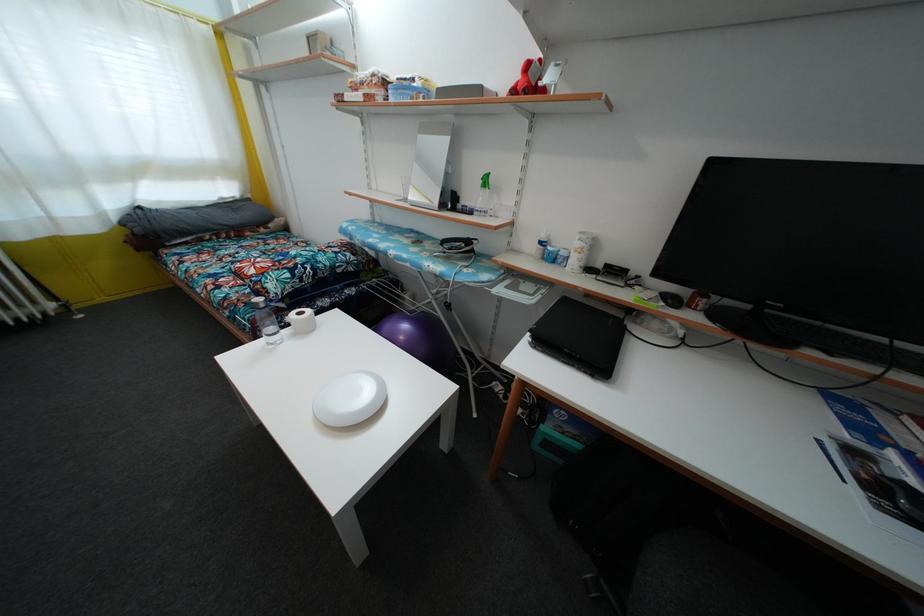
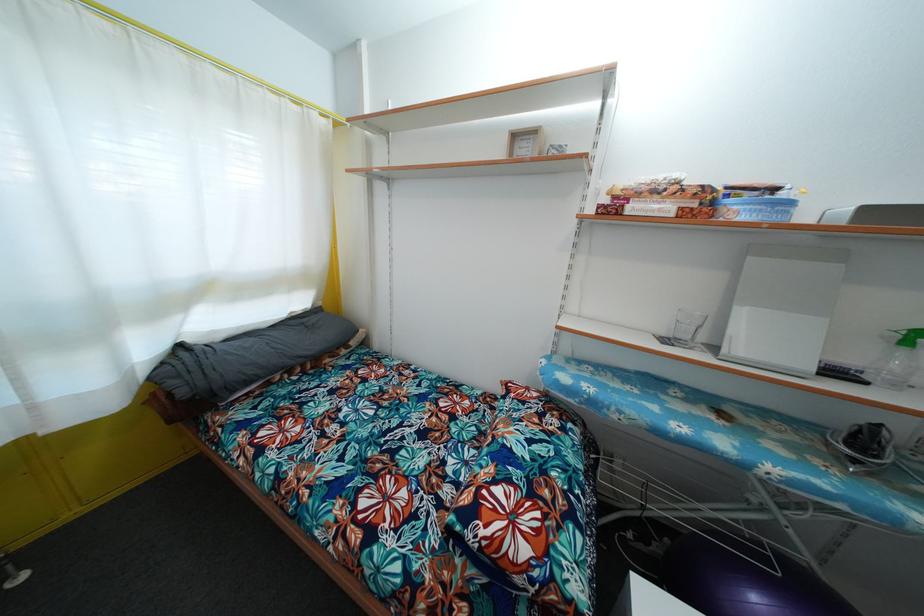
In the second image, find the point that corresponds to the point at 378,82 in the first image.

(683, 188)